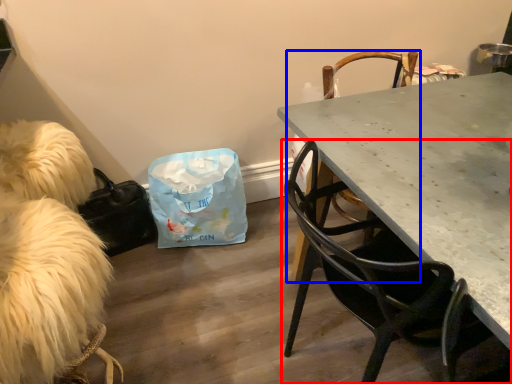
Question: Which of the following is the farthest to the observer, chair (highlighted by a red box) or chair (highlighted by a blue box)?

Choices:
 (A) chair
 (B) chair

Answer: (B)